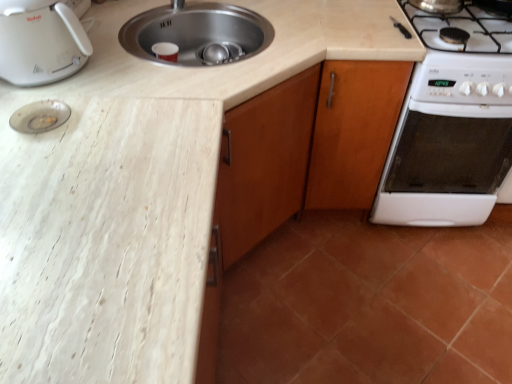
Question: Is the position of white glossy oven at right more distant than that of white marble countertop at left?

Choices:
 (A) yes
 (B) no

Answer: (A)

Question: Can you confirm if white glossy oven at right is bigger than white marble countertop at left?

Choices:
 (A) yes
 (B) no

Answer: (B)

Question: Does white glossy oven at right have a greater height compared to white marble countertop at left?

Choices:
 (A) no
 (B) yes

Answer: (A)

Question: Can you confirm if white glossy oven at right is wider than white marble countertop at left?

Choices:
 (A) no
 (B) yes

Answer: (A)

Question: Is white glossy oven at right not within white marble countertop at left?

Choices:
 (A) no
 (B) yes

Answer: (B)

Question: From the image's perspective, is white glossy oven at right below white marble countertop at left?

Choices:
 (A) yes
 (B) no

Answer: (B)

Question: Is white glossy oven at right positioned behind terracotta tile at lower right?

Choices:
 (A) no
 (B) yes

Answer: (B)

Question: From a real-world perspective, does white glossy oven at right sit lower than terracotta tile at lower right?

Choices:
 (A) yes
 (B) no

Answer: (B)

Question: Is white glossy oven at right facing towards terracotta tile at lower right?

Choices:
 (A) no
 (B) yes

Answer: (B)

Question: Are white glossy oven at right and terracotta tile at lower right making contact?

Choices:
 (A) yes
 (B) no

Answer: (B)

Question: Does white glossy oven at right have a larger size compared to terracotta tile at lower right?

Choices:
 (A) yes
 (B) no

Answer: (A)

Question: Is white glossy oven at right positioned far away from terracotta tile at lower right?

Choices:
 (A) yes
 (B) no

Answer: (B)

Question: Does terracotta tile at lower right have a larger size compared to white plastic toaster at upper left?

Choices:
 (A) yes
 (B) no

Answer: (A)